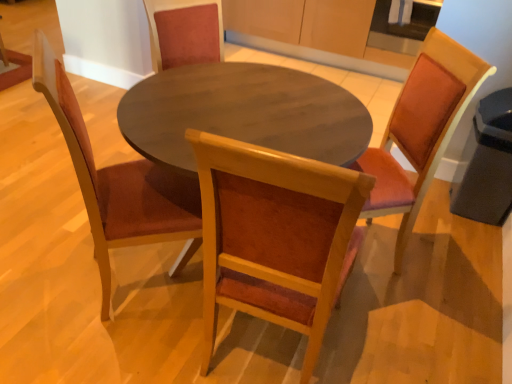
Locate an element on the screen. Image resolution: width=512 pixels, height=384 pixels. space that is in front of wooden chair at right, the third chair viewed from the left is located at coordinates (386, 327).